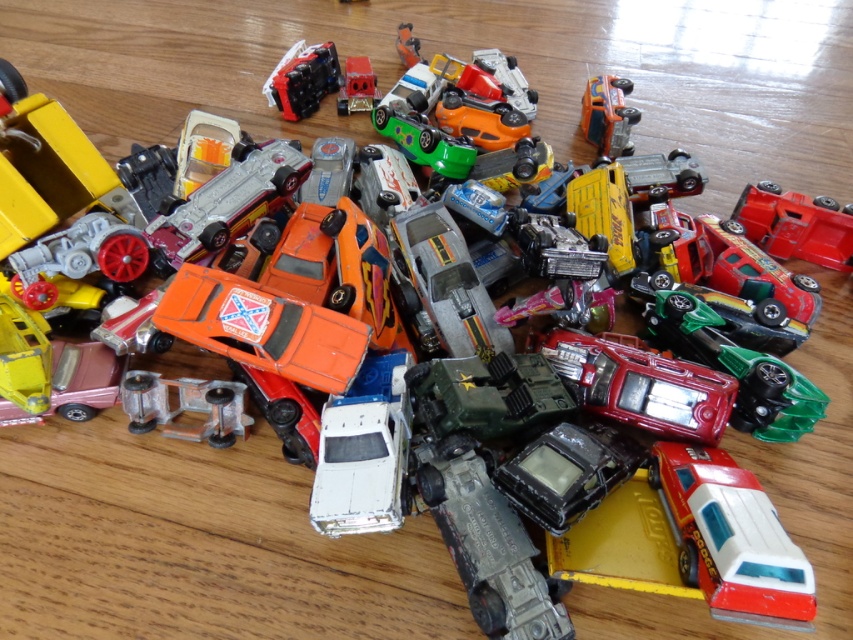
Is shiny plastic car at upper center to the right of shiny orange car at upper right from the viewer's perspective?

In fact, shiny plastic car at upper center is to the left of shiny orange car at upper right.

Between shiny plastic car at upper center and shiny orange car at upper right, which one is positioned lower?

shiny orange car at upper right

Measure the distance between point (299, 81) and camera.

Point (299, 81) is 6.10 feet from camera.

At what (x,y) coordinates should I click in order to perform the action: click on shiny plastic car at upper center. Please return your answer as a coordinate pair (x, y). Looking at the image, I should click on (303, 80).

Between point (746, 221) and point (334, 45), which one is positioned behind?

The point (334, 45) is more distant.

Does shiny red truck at center appear on the right side of shiny plastic car at upper center?

Correct, you'll find shiny red truck at center to the right of shiny plastic car at upper center.

Describe the element at coordinates (796, 225) in the screenshot. I see `shiny red truck at center` at that location.

This screenshot has height=640, width=853. Find the location of `shiny red truck at center`. shiny red truck at center is located at coordinates (796, 225).

Which is in front, point (817, 241) or point (590, 132)?

Point (817, 241) is more forward.

Does shiny red truck at center appear under shiny orange car at upper right?

Yes, shiny red truck at center is below shiny orange car at upper right.

Is point (828, 253) in front of point (590, 92)?

Yes, point (828, 253) is in front of point (590, 92).

Where is `shiny red truck at center`? This screenshot has width=853, height=640. shiny red truck at center is located at coordinates (796, 225).